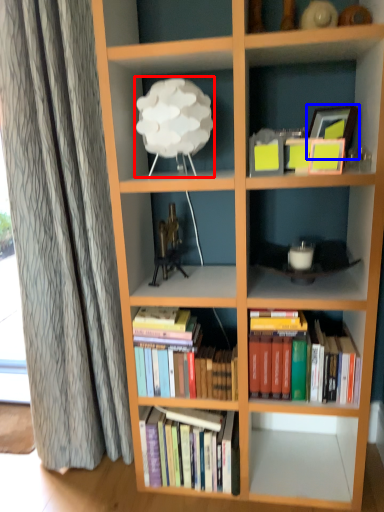
Question: Which object appears farthest to the camera in this image, lamp (highlighted by a red box) or picture frame (highlighted by a blue box)?

Choices:
 (A) lamp
 (B) picture frame

Answer: (B)